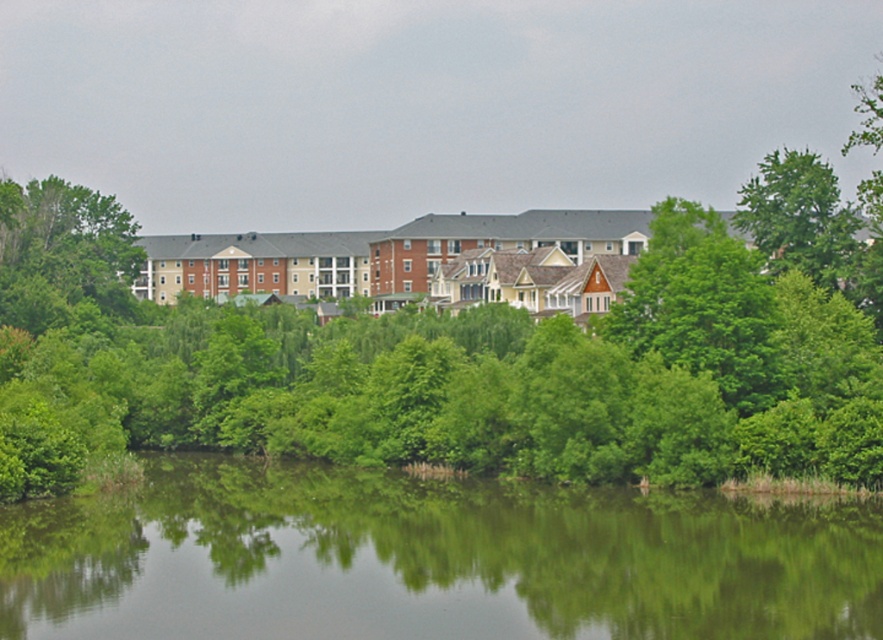
Question: Which object appears farthest from the camera in this image?

Choices:
 (A) green reflective water at center
 (B) green leafy tree at upper right
 (C) green leafy tree at center

Answer: (B)

Question: Is green leafy tree at center positioned in front of green reflective water at center?

Choices:
 (A) no
 (B) yes

Answer: (A)

Question: Considering the real-world distances, which object is farthest from the green leafy tree at center?

Choices:
 (A) green reflective water at center
 (B) green leafy tree at upper right

Answer: (B)

Question: Observing the image, what is the correct spatial positioning of green leafy tree at center in reference to green leafy tree at upper right?

Choices:
 (A) below
 (B) above

Answer: (A)

Question: Does green leafy tree at center appear over green reflective water at center?

Choices:
 (A) yes
 (B) no

Answer: (A)

Question: Which object is the farthest from the green leafy tree at upper right?

Choices:
 (A) green reflective water at center
 (B) green leafy tree at center

Answer: (B)